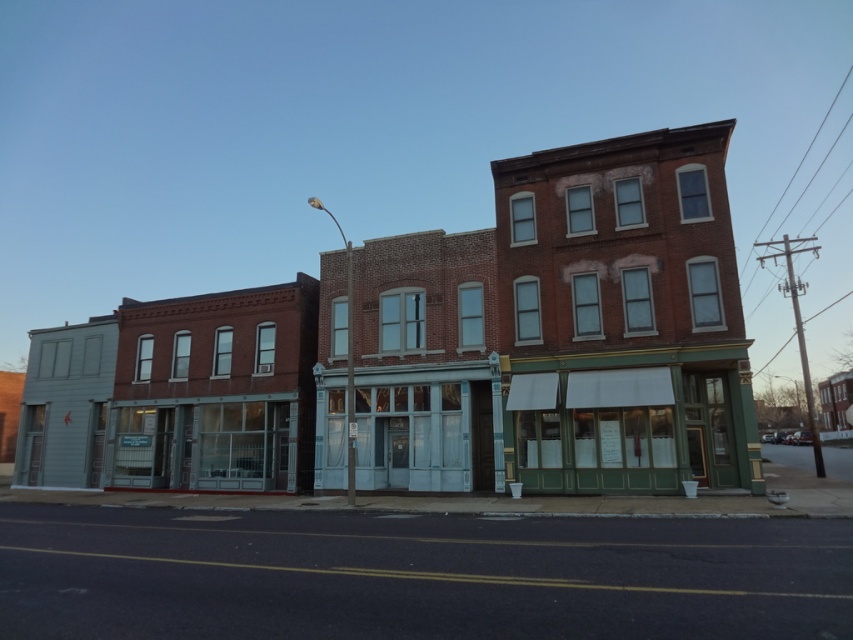
You are standing in front of the row of three story brick buildings. You notice two points marked on the buildings. The first point is at coordinate point (654, 449) and the second is at point (466, 454). Which point is closer to you?

Point (654, 449) is closer to the camera than point (466, 454).

You are standing on the sidewalk in front of the three buildings. You notice both the brick building at center and the clear glass storefront at center. Which one is closer to you?

The brick building at center is closer to you because it is in front of the clear glass storefront at center.

You are standing on the sidewalk in front of the row of three story brick buildings. You see a green painted wood storefront at center and a white glass storefront at center. Which storefront is closer to you?

The green painted wood storefront at center is closer to the viewer than the white glass storefront at center.